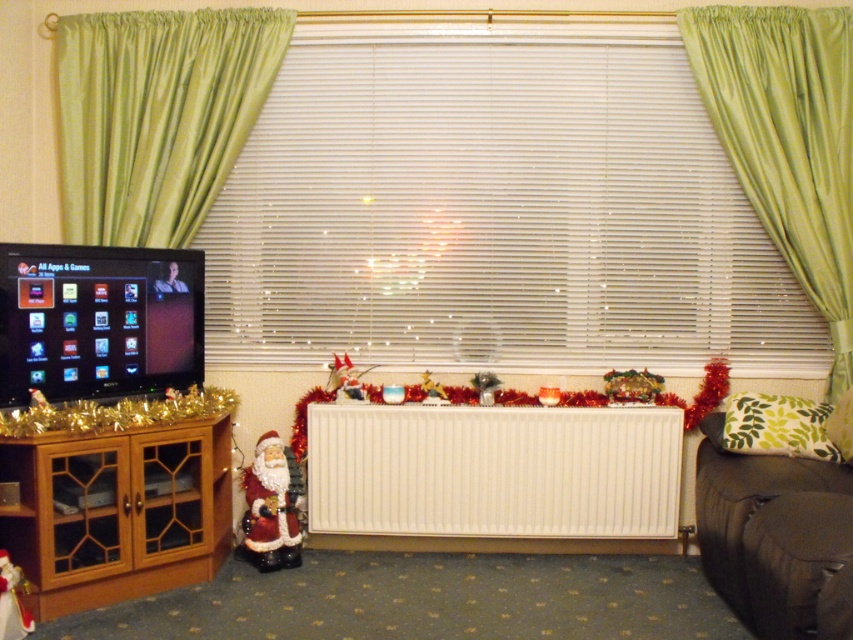
Who is positioned more to the left, wooden cabinet at left or dark brown leather couch at lower right?

wooden cabinet at left

Identify the location of wooden cabinet at left. (117, 513).

Find the location of a particular element. The height and width of the screenshot is (640, 853). wooden cabinet at left is located at coordinates (117, 513).

At what (x,y) coordinates should I click in order to perform the action: click on wooden cabinet at left. Please return your answer as a coordinate pair (x, y). This screenshot has height=640, width=853. Looking at the image, I should click on (117, 513).

Does dark brown leather couch at lower right lie behind shiny metallic tinsel at center?

No, dark brown leather couch at lower right is in front of shiny metallic tinsel at center.

Can you confirm if dark brown leather couch at lower right is positioned to the left of shiny metallic tinsel at center?

No, dark brown leather couch at lower right is not to the left of shiny metallic tinsel at center.

Which is in front, point (753, 579) or point (496, 392)?

Point (753, 579) is in front.

At what (x,y) coordinates should I click in order to perform the action: click on dark brown leather couch at lower right. Please return your answer as a coordinate pair (x, y). Looking at the image, I should click on (776, 538).

Can you confirm if white matte radiator at center is positioned to the left of green satin curtain at upper left?

In fact, white matte radiator at center is to the right of green satin curtain at upper left.

Measure the distance between white matte radiator at center and camera.

They are 10.22 feet apart.

I want to click on white matte radiator at center, so click(492, 470).